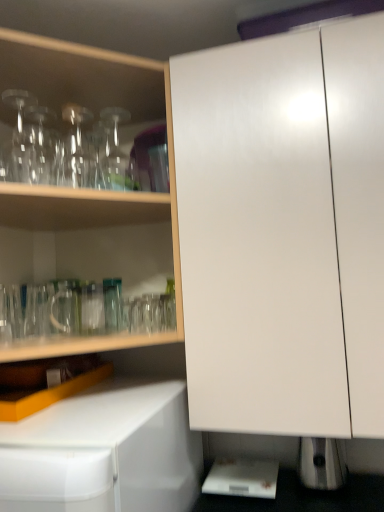
Question: Considering the positions of transparent glass bottle at upper left, acting as the second bottle starting from the left, and transparent glass bottle at upper left, acting as the second bottle starting from the right, in the image, is transparent glass bottle at upper left, acting as the second bottle starting from the left, wider or thinner than transparent glass bottle at upper left, acting as the second bottle starting from the right,?

Choices:
 (A) thin
 (B) wide

Answer: (B)

Question: Considering their positions, is transparent glass bottle at upper left, acting as the second bottle starting from the left, located in front of or behind transparent glass bottle at upper left, the first bottle when ordered from left to right?

Choices:
 (A) front
 (B) behind

Answer: (A)

Question: Considering the real-world distances, which object is closest to the transparent glass bottle at upper left, which is the 1th bottle in right-to-left order?

Choices:
 (A) transparent glass bottle at upper left, the first bottle when ordered from left to right
 (B) transparent glassware at upper left, marked as the 2th cabinetry in a right-to-left arrangement
 (C) white glossy cabinet at center, which appears as the 1th cabinetry when viewed from the right

Answer: (A)

Question: Estimate the real-world distances between objects in this image. Which object is closer to the transparent glassware at upper left, arranged as the first cabinetry when viewed from the left?

Choices:
 (A) white glossy cabinet at center, marked as the second cabinetry in a left-to-right arrangement
 (B) transparent glass bottle at upper left, the first bottle when ordered from left to right
 (C) transparent glass bottle at upper left, acting as the second bottle starting from the left

Answer: (B)